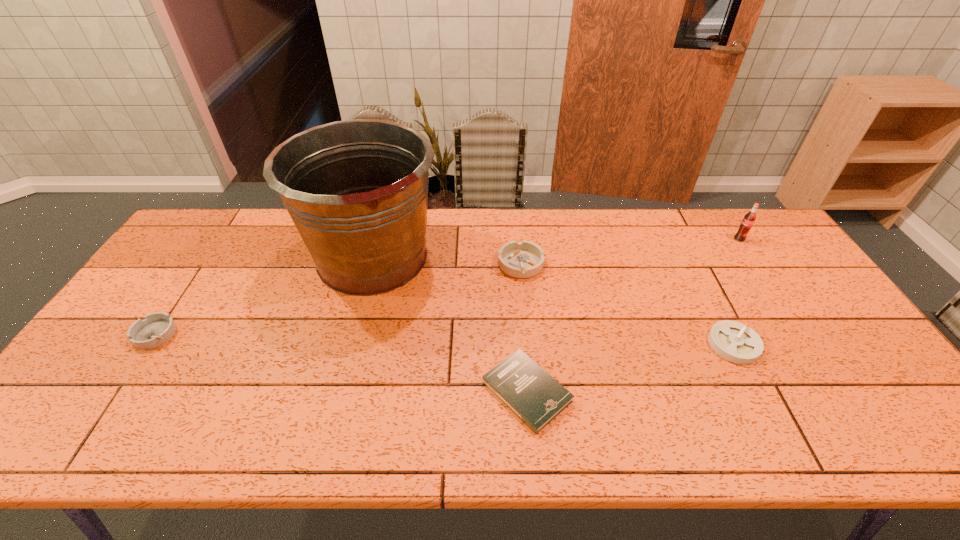
Identify which object is the nearest to the second object from left to right. Please provide its 2D coordinates. Your answer should be formatted as a tuple, i.e. [(x, y)], where the tuple contains the x and y coordinates of a point satisfying the conditions above.

[(524, 259)]

Find the location of a particular element. This screenshot has height=540, width=960. ashtray that is the closest to the soda bottle is located at coordinates (736, 342).

Identify which ashtray is the nearest to the fifth object from right to left. Please provide its 2D coordinates. Your answer should be formatted as a tuple, i.e. [(x, y)], where the tuple contains the x and y coordinates of a point satisfying the conditions above.

[(524, 259)]